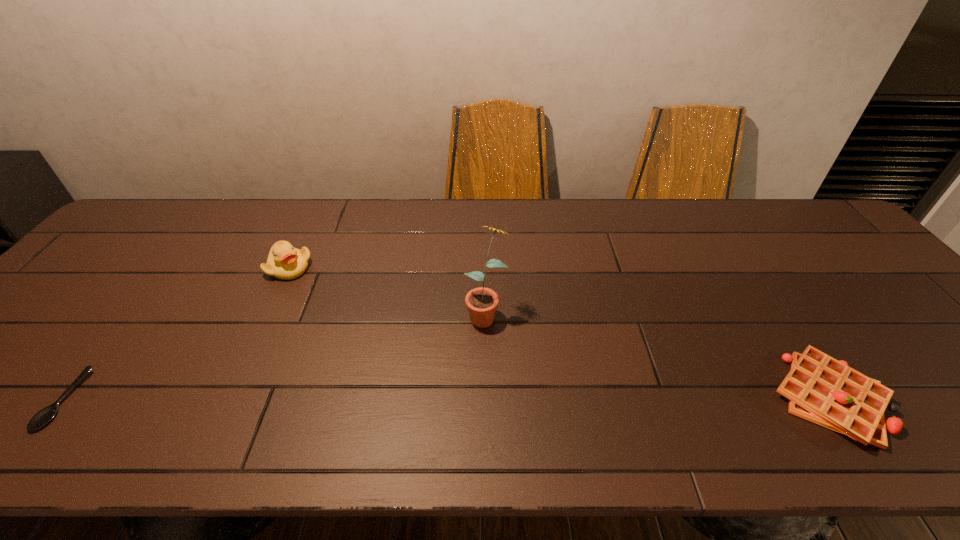
At what (x,y) coordinates should I click in order to perform the action: click on vacant space on the desktop that is between the soupspoon and the rightmost object and is positioned on the flower of the third nearest object. Please return your answer as a coordinate pair (x, y). Looking at the image, I should click on (426, 399).

This screenshot has height=540, width=960. Identify the location of free spot on the desktop that is between the shortest object and the second shortest object and is positioned at the face of the second object from left to right. (532, 399).